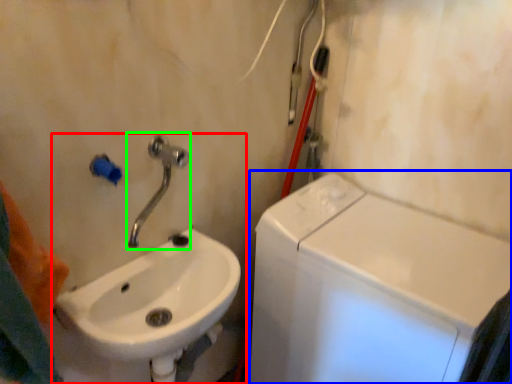
Question: Based on their relative distances, which object is farther from sink (highlighted by a red box)? Choose from washing machine (highlighted by a blue box) and tap (highlighted by a green box).

Choices:
 (A) washing machine
 (B) tap

Answer: (A)